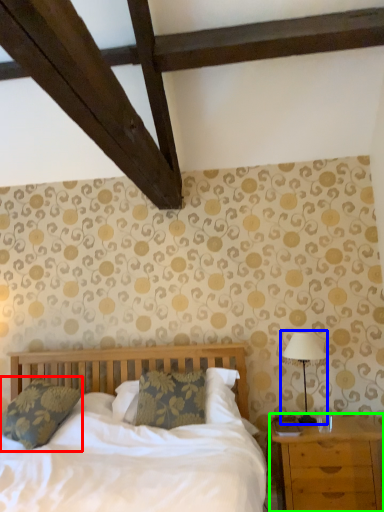
Question: Based on their relative distances, which object is farther from pillow (highlighted by a red box)? Choose from table lamp (highlighted by a blue box) and nightstand (highlighted by a green box).

Choices:
 (A) table lamp
 (B) nightstand

Answer: (A)